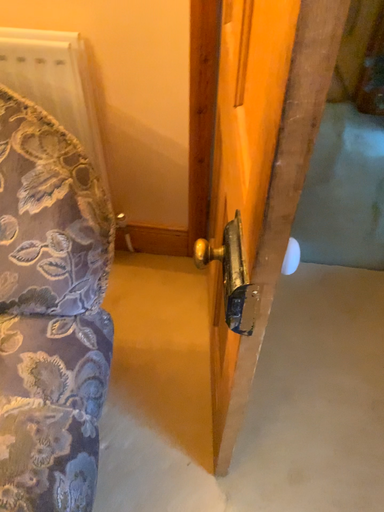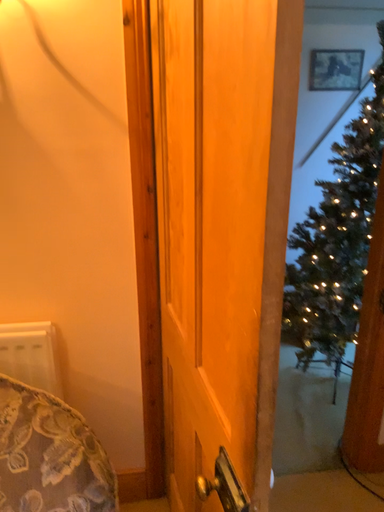
Question: How did the camera likely rotate when shooting the video?

Choices:
 (A) rotated upward
 (B) rotated downward

Answer: (A)